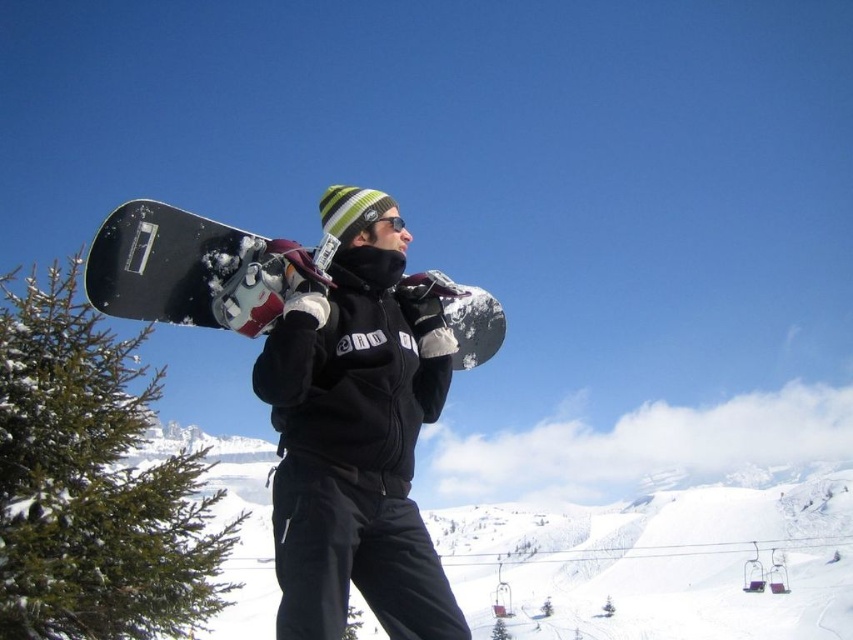
Can you confirm if green matte pine at left is positioned to the left of metallic purple ski lift at lower right?

Yes, green matte pine at left is to the left of metallic purple ski lift at lower right.

Consider the image. Is green matte pine at left wider than metallic purple ski lift at lower right?

Correct, the width of green matte pine at left exceeds that of metallic purple ski lift at lower right.

Which is behind, point (108, 490) or point (780, 557)?

The point (780, 557) is behind.

This screenshot has height=640, width=853. What are the coordinates of `green matte pine at left` in the screenshot? It's located at (93, 481).

Can you confirm if white fluffy snow at center is positioned below black matte snowboard at upper center?

Yes.

Which is behind, point (254, 532) or point (114, 221)?

The point (254, 532) is behind.

I want to click on white fluffy snow at center, so click(660, 560).

Does white fluffy snow at center lie behind matte black snowboard at center?

Yes, white fluffy snow at center is further from the viewer.

Who is positioned more to the left, white fluffy snow at center or matte black snowboard at center?

matte black snowboard at center

The width and height of the screenshot is (853, 640). In order to click on white fluffy snow at center in this screenshot , I will do click(660, 560).

Identify the location of white fluffy snow at center. (660, 560).